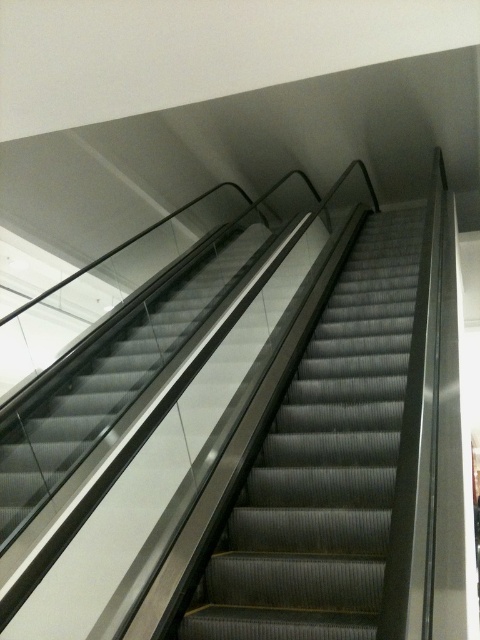
You are standing at the entrance of the escalators and need to locate the metallic gray escalator at center. According to the coordinates provided, where exactly is it positioned?

The metallic gray escalator at center is located at point (x=324, y=465), which means it is positioned towards the upper right section of the frame based on the coordinate system provided.

You are a delivery person carrying a large box that measures 4 feet in width. You need to walk between the metallic gray escalator at center and the metallic gray escalator at left. Can you pass through the space between them without tilting the box?

The distance between the metallic gray escalator at center and the metallic gray escalator at left is 4.13 feet. Since your box is 4 feet wide, there is enough space to pass through without tilting it.

You are standing at the base of the metallic gray escalator at center. You want to take a photo of it with your phone, which has a maximum focus range of 5 feet. Can you take a clear photo without moving closer?

The metallic gray escalator at center is 5.86 feet from camera. Since your phone can only focus up to 5 feet, you are too far away to take a clear photo. Move closer to within 5 feet first.